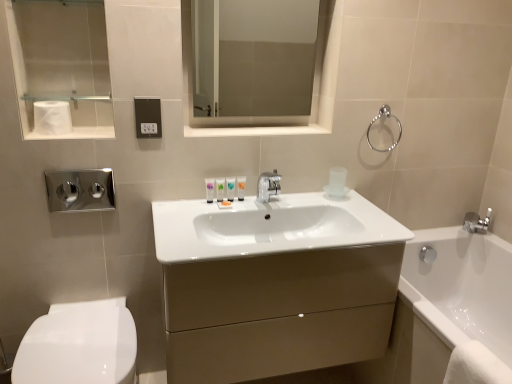
In order to click on free spot in front of white glossy tube at center, acting as the 3th toiletry starting from the right in this screenshot , I will do `click(197, 215)`.